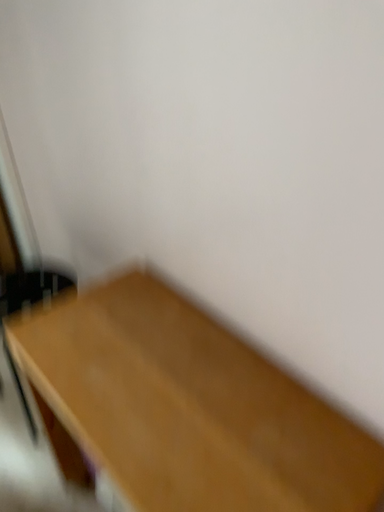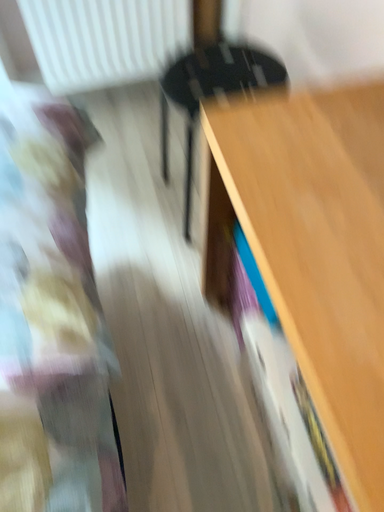
Question: Which way did the camera rotate in the video?

Choices:
 (A) rotated upward
 (B) rotated downward

Answer: (B)